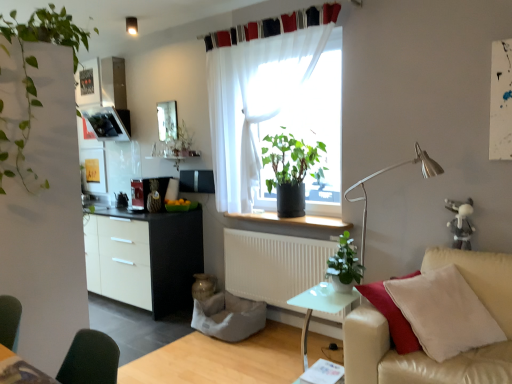
Where is `vacant area on top of white matte radiator at lower center (from a real-world perspective)`? The image size is (512, 384). vacant area on top of white matte radiator at lower center (from a real-world perspective) is located at coordinates (287, 231).